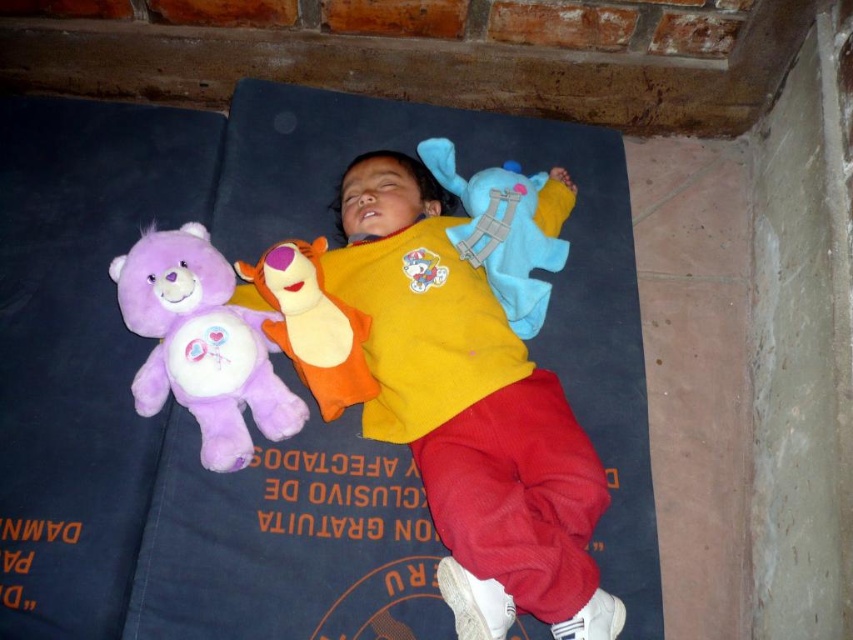
Question: Based on their relative distances, which object is farther from the yellow soft fabric shirt at center?

Choices:
 (A) purple plush bear at left
 (B) blue plush toy at upper center

Answer: (A)

Question: Does purple plush bear at left appear on the right side of blue plush toy at upper center?

Choices:
 (A) yes
 (B) no

Answer: (B)

Question: Considering the relative positions of yellow soft fabric shirt at center and blue plush toy at upper center in the image provided, where is yellow soft fabric shirt at center located with respect to blue plush toy at upper center?

Choices:
 (A) left
 (B) right

Answer: (A)

Question: Is yellow soft fabric shirt at center to the right of blue plush toy at upper center from the viewer's perspective?

Choices:
 (A) no
 (B) yes

Answer: (A)

Question: Which object is the closest to the yellow soft fabric shirt at center?

Choices:
 (A) purple plush tiger at center
 (B) blue plush toy at upper center
 (C) purple plush bear at left

Answer: (B)

Question: Among these objects, which one is farthest from the camera?

Choices:
 (A) purple plush tiger at center
 (B) blue plush toy at upper center
 (C) purple plush bear at left

Answer: (B)